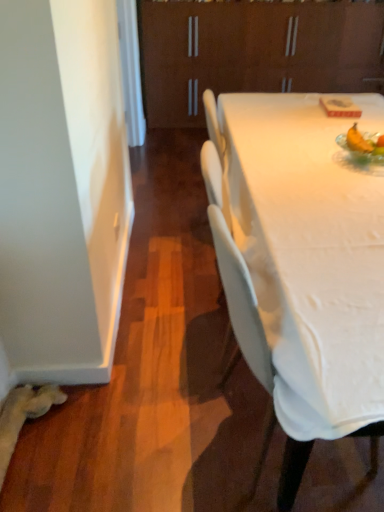
Locate an element on the screen. vacant position to the left of translucent glass bowl at upper right is located at coordinates (304, 161).